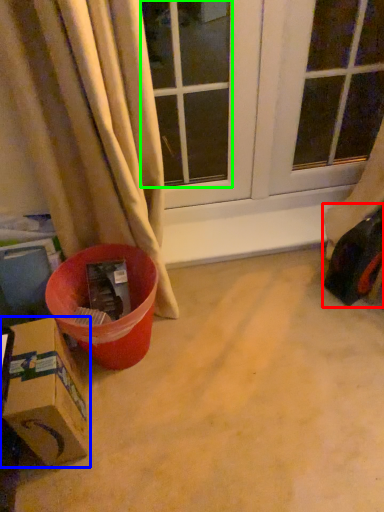
Question: Based on their relative distances, which object is farther from toy car (highlighted by a red box)? Choose from box (highlighted by a blue box) and window (highlighted by a green box).

Choices:
 (A) box
 (B) window

Answer: (B)